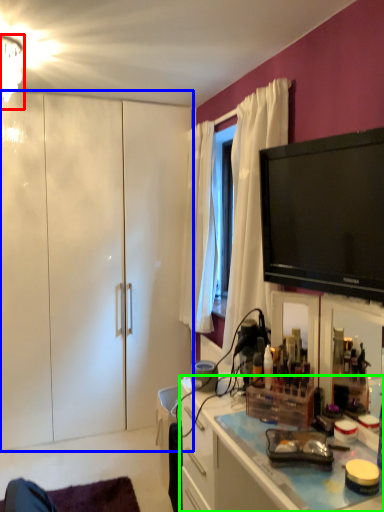
Question: Which is farther away from lamp (highlighted by a red box)? cabinetry (highlighted by a blue box) or cabinetry (highlighted by a green box)?

Choices:
 (A) cabinetry
 (B) cabinetry

Answer: (B)